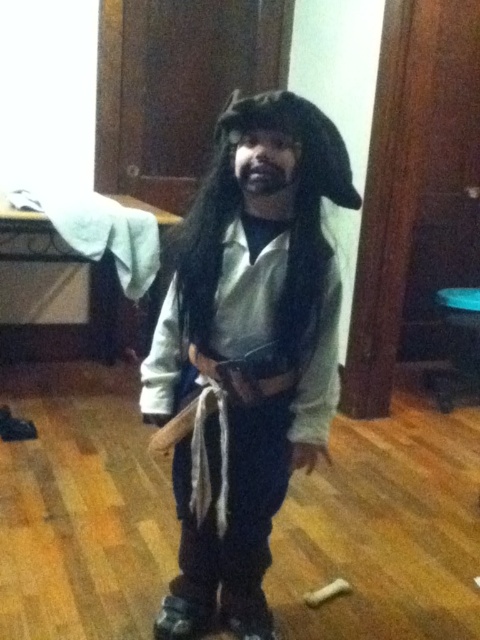
Who is more distant from viewer, (197,540) or (286,179)?

Point (197,540)

Which is more to the left, white matte pirate costume at center or black matte beard at center?

white matte pirate costume at center

The width and height of the screenshot is (480, 640). What do you see at coordinates (248, 356) in the screenshot? I see `white matte pirate costume at center` at bounding box center [248, 356].

This screenshot has height=640, width=480. Find the location of `white matte pirate costume at center`. white matte pirate costume at center is located at coordinates (248, 356).